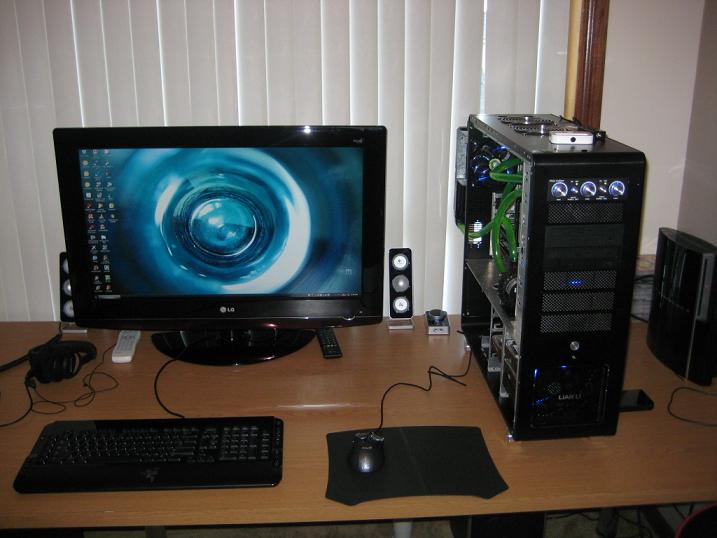
Where is `window trim`? Image resolution: width=717 pixels, height=538 pixels. window trim is located at coordinates (599, 91).